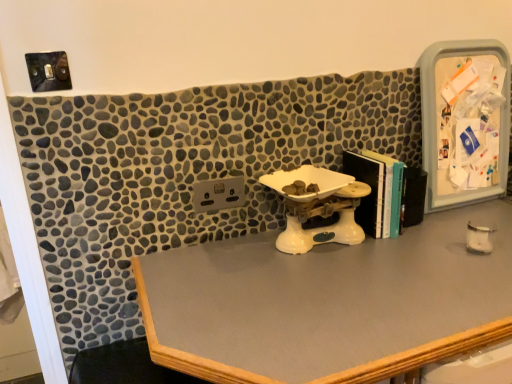
Question: Is plastic/transparent medicine cabinet at right taller or shorter than hardcover books at center-right?

Choices:
 (A) tall
 (B) short

Answer: (A)

Question: From a real-world perspective, is plastic/transparent medicine cabinet at right positioned above or below hardcover books at center-right?

Choices:
 (A) above
 (B) below

Answer: (A)

Question: Which object is the closest to the white plastic scale at center?

Choices:
 (A) hardcover books at center-right
 (B) plastic/transparent medicine cabinet at right
 (C) smooth gray desk at center

Answer: (A)

Question: Estimate the real-world distances between objects in this image. Which object is closer to the white plastic scale at center?

Choices:
 (A) smooth gray desk at center
 (B) hardcover books at center-right
 (C) plastic/transparent medicine cabinet at right

Answer: (B)